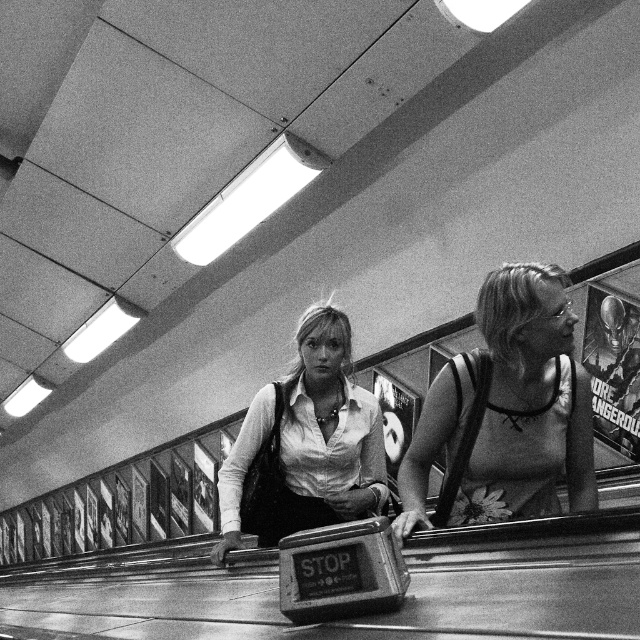
Does floral-patterned tank top at right have a greater height compared to matte white shirt at center?

No, floral-patterned tank top at right is not taller than matte white shirt at center.

Describe the element at coordinates (529, 403) in the screenshot. I see `floral-patterned tank top at right` at that location.

Does point (492, 516) lie behind point (292, 435)?

No, it is in front of (292, 435).

Find the location of a particular element. floral-patterned tank top at right is located at coordinates (529, 403).